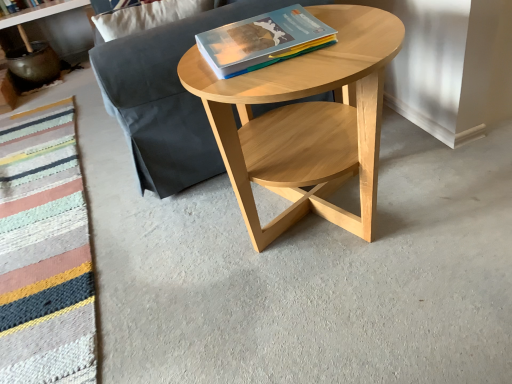
Where is `blank space above knitted wool blanket at lower left (from a real-world perspective)`? This screenshot has height=384, width=512. blank space above knitted wool blanket at lower left (from a real-world perspective) is located at coordinates tap(23, 178).